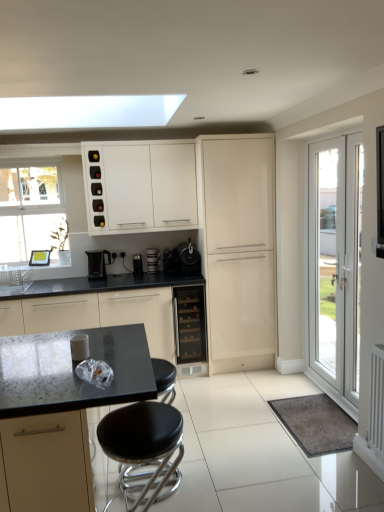
Question: Is the position of black glass wine cooler at center more distant than that of black plastic coffee maker at center, placed as the 2th appliance when sorted from left to right?

Choices:
 (A) yes
 (B) no

Answer: (B)

Question: Does black glass wine cooler at center have a larger size compared to black plastic coffee maker at center, placed as the 2th appliance when sorted from left to right?

Choices:
 (A) yes
 (B) no

Answer: (A)

Question: Is black glass wine cooler at center aimed at black plastic coffee maker at center, placed as the 2th appliance when sorted from left to right?

Choices:
 (A) yes
 (B) no

Answer: (B)

Question: Can you confirm if black glass wine cooler at center is shorter than black plastic coffee maker at center, marked as the 2th appliance in a right-to-left arrangement?

Choices:
 (A) yes
 (B) no

Answer: (B)

Question: Is black glass wine cooler at center thinner than black plastic coffee maker at center, marked as the 2th appliance in a right-to-left arrangement?

Choices:
 (A) no
 (B) yes

Answer: (A)

Question: Is black glass wine cooler at center taller than black plastic coffee maker at center, placed as the 2th appliance when sorted from left to right?

Choices:
 (A) yes
 (B) no

Answer: (A)

Question: Would you consider white glossy door at right to be distant from black plastic kettle at center?

Choices:
 (A) yes
 (B) no

Answer: (A)

Question: Can you confirm if white glossy door at right is shorter than black plastic kettle at center?

Choices:
 (A) yes
 (B) no

Answer: (B)

Question: Considering the relative sizes of white glossy door at right and black plastic kettle at center in the image provided, is white glossy door at right taller than black plastic kettle at center?

Choices:
 (A) yes
 (B) no

Answer: (A)

Question: From a real-world perspective, is white glossy door at right located higher than black plastic kettle at center?

Choices:
 (A) no
 (B) yes

Answer: (A)

Question: Considering the relative positions of white glossy door at right and black plastic kettle at center in the image provided, is white glossy door at right to the right of black plastic kettle at center from the viewer's perspective?

Choices:
 (A) no
 (B) yes

Answer: (B)

Question: Can you confirm if white glossy door at right is wider than black plastic kettle at center?

Choices:
 (A) yes
 (B) no

Answer: (B)

Question: Is white glossy wine rack at upper center, which is counted as the first cabinetry, starting from the back, closer to the viewer compared to metallic black coffee machine at center?

Choices:
 (A) yes
 (B) no

Answer: (A)